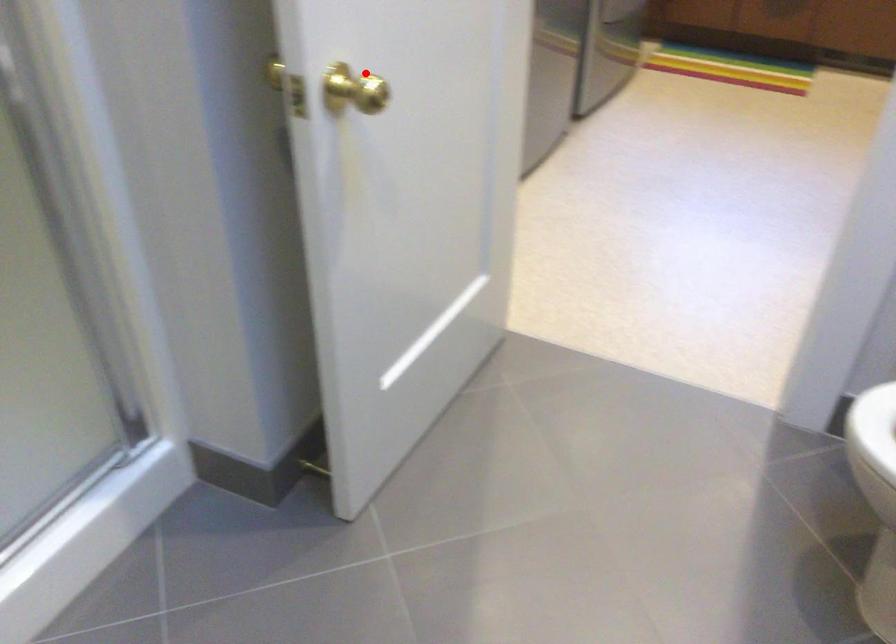
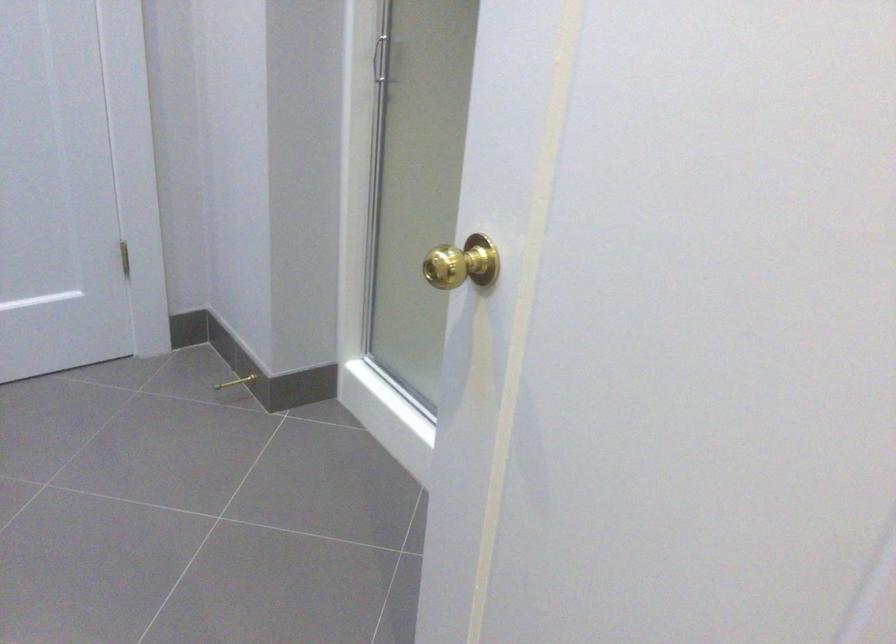
Question: I am providing you with two images of the same scene from different viewpoints. Given a red point in image1, look at the same physical point in image2. Is it:

Choices:
 (A) Closer to the viewpoint
 (B) Farther from the viewpoint

Answer: (A)